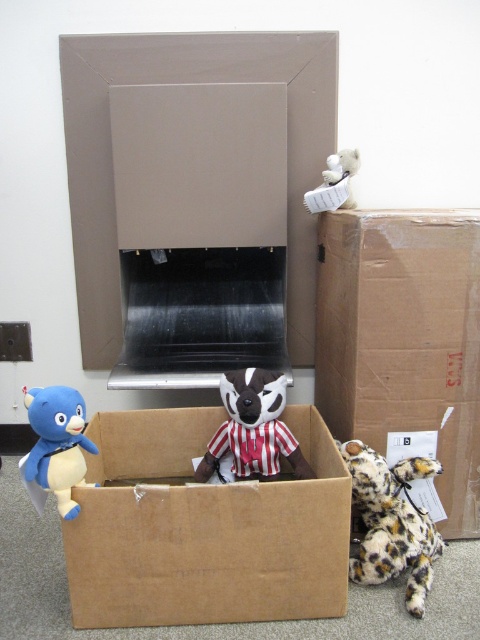
Question: Observing the image, what is the correct spatial positioning of striped plush toy at center in reference to matte blue plush at left?

Choices:
 (A) left
 (B) right

Answer: (B)

Question: Is leopard print plush at lower right above matte blue plush at left?

Choices:
 (A) no
 (B) yes

Answer: (A)

Question: Is matte cardboard box at center to the left of leopard print plush at lower right from the viewer's perspective?

Choices:
 (A) yes
 (B) no

Answer: (A)

Question: Estimate the real-world distances between objects in this image. Which object is farther from the brown cardboard box at lower right?

Choices:
 (A) striped plush toy at center
 (B) leopard print plush at lower right
 (C) matte blue plush at left
 (D) brown cardboard box at center

Answer: (C)

Question: Among these points, which one is farthest from the camera?

Choices:
 (A) (300, 438)
 (B) (337, 276)

Answer: (A)

Question: Which object is closer to the camera taking this photo?

Choices:
 (A) matte blue plush at left
 (B) brown cardboard box at center
 (C) white plush bear at upper right

Answer: (A)